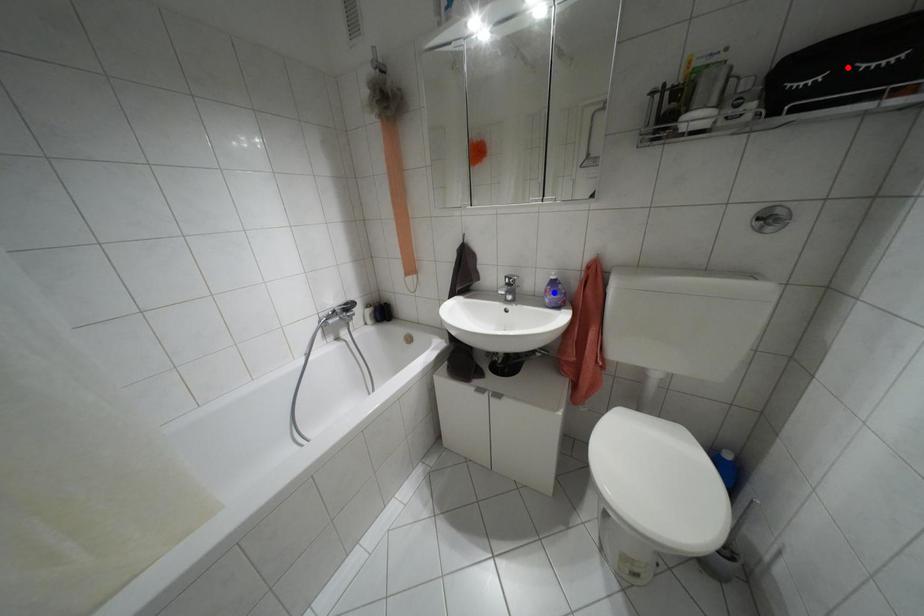
Question: Two points are marked on the image. Which point is closer to the camera?

Choices:
 (A) Blue point is closer.
 (B) Red point is closer.

Answer: (B)